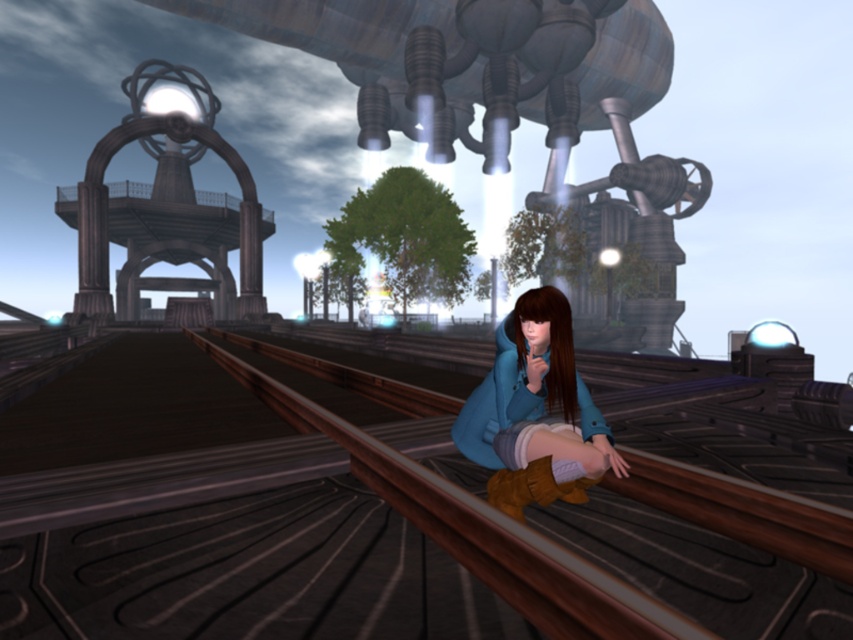
Does blue suede boots at lower center appear under brown leather boot at lower center?

Actually, blue suede boots at lower center is above brown leather boot at lower center.

Does blue suede boots at lower center have a lesser width compared to brown leather boot at lower center?

In fact, blue suede boots at lower center might be wider than brown leather boot at lower center.

The height and width of the screenshot is (640, 853). I want to click on blue suede boots at lower center, so click(x=535, y=412).

Can you confirm if brown wooden train track at center is taller than blue suede boots at lower center?

No, brown wooden train track at center is not taller than blue suede boots at lower center.

Who is more forward, [639,536] or [585,477]?

Point [585,477] is more forward.

The width and height of the screenshot is (853, 640). What are the coordinates of `brown wooden train track at center` in the screenshot? It's located at (207, 518).

Is brown wooden train track at center above brown leather boot at lower center?

No, brown wooden train track at center is not above brown leather boot at lower center.

Can you confirm if brown wooden train track at center is bigger than brown leather boot at lower center?

No, brown wooden train track at center is not bigger than brown leather boot at lower center.

Locate an element on the screen. Image resolution: width=853 pixels, height=640 pixels. brown wooden train track at center is located at coordinates (207, 518).

Where is `brown wooden train track at center`? brown wooden train track at center is located at coordinates (207, 518).